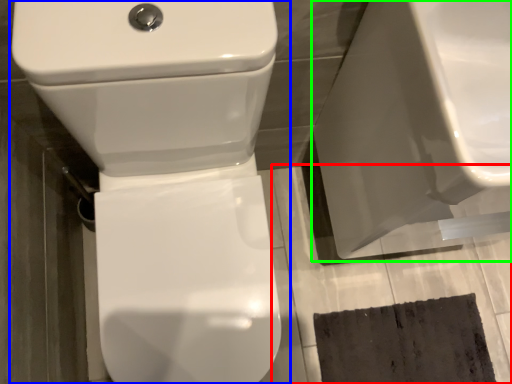
Question: Which object is positioned farthest from concrete (highlighted by a red box)? Select from toilet (highlighted by a blue box) and porcelain (highlighted by a green box).

Choices:
 (A) toilet
 (B) porcelain

Answer: (A)